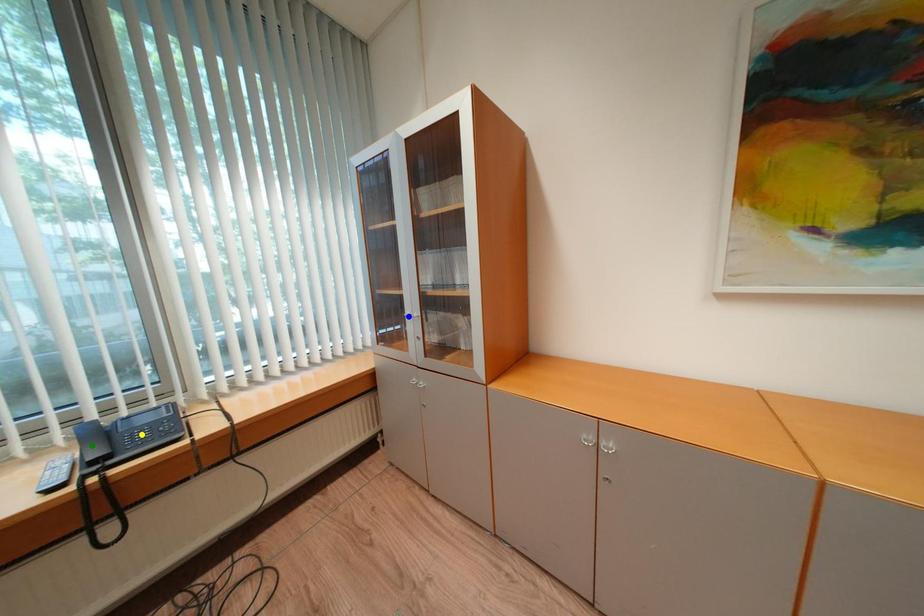
Order these from nearest to farthest:
blue point
green point
yellow point

blue point, yellow point, green point